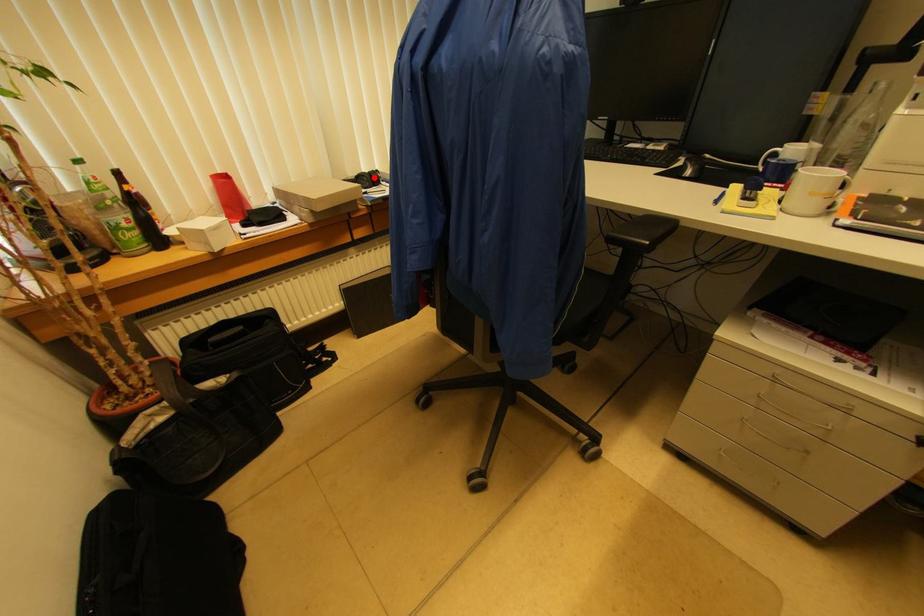
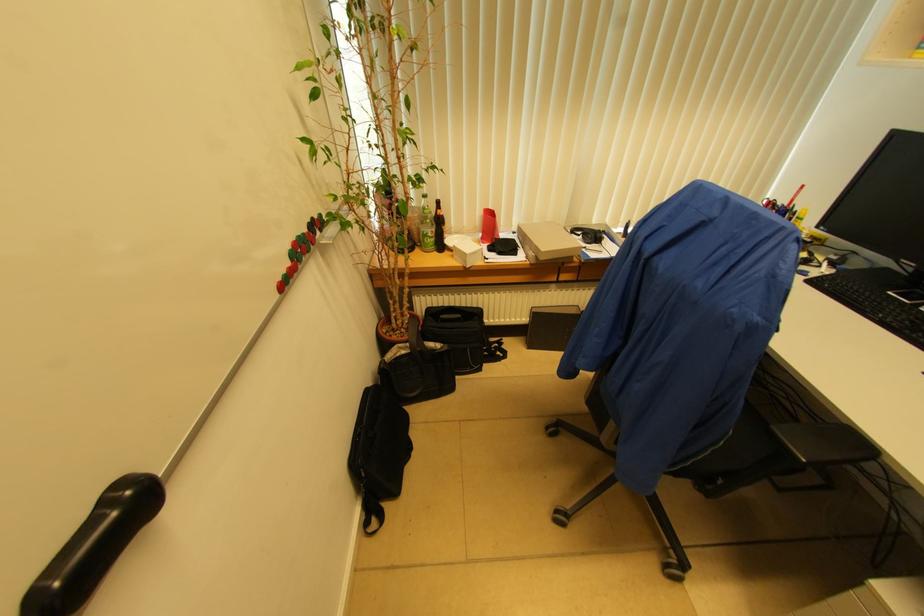
The point at the highlighted location is marked in the first image. Where is the corresponding point in the second image?

(599, 237)